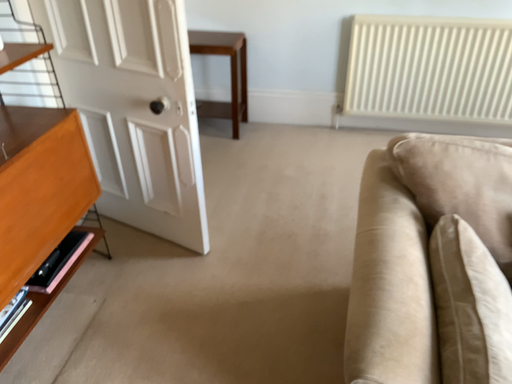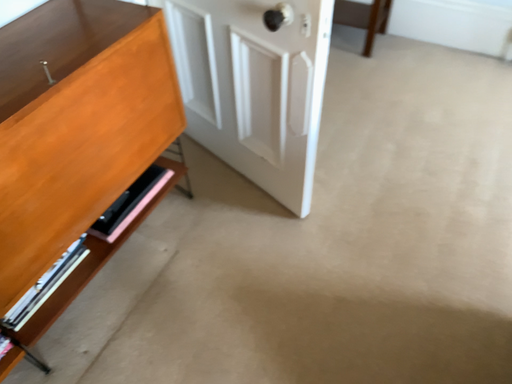
Question: Which way did the camera rotate in the video?

Choices:
 (A) rotated left
 (B) rotated right

Answer: (A)